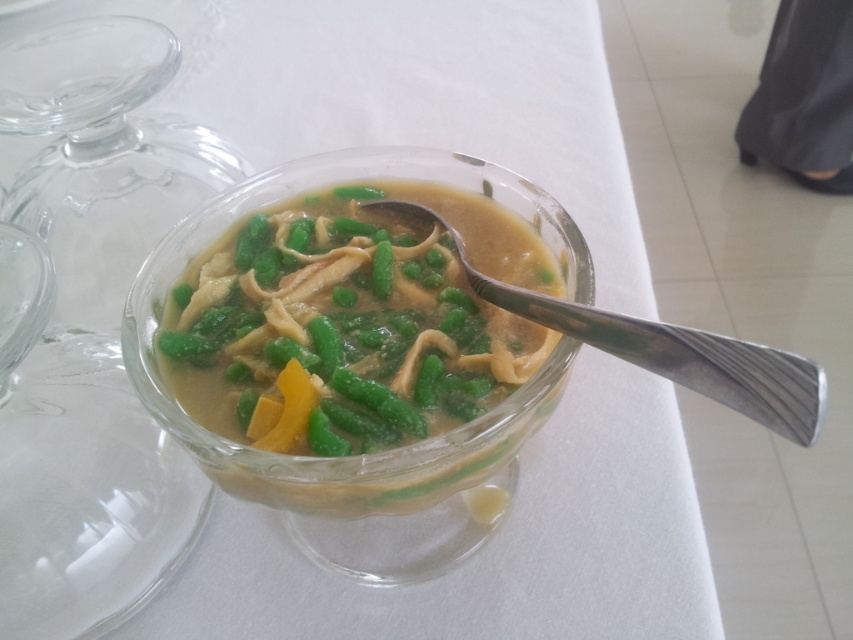
Question: Can you confirm if translucent glass bowl at center is bigger than silver metallic spoon at center?

Choices:
 (A) no
 (B) yes

Answer: (B)

Question: Which of the following is the closest to the observer?

Choices:
 (A) (628, 360)
 (B) (280, 257)

Answer: (A)

Question: Is translucent glass bowl at center to the left of silver metallic spoon at center from the viewer's perspective?

Choices:
 (A) no
 (B) yes

Answer: (B)

Question: Among these objects, which one is nearest to the camera?

Choices:
 (A) silver metallic spoon at center
 (B) translucent glass bowl at center

Answer: (A)

Question: Which point is farther to the camera?

Choices:
 (A) (469, 284)
 (B) (490, 256)

Answer: (B)

Question: Where is translucent glass bowl at center located in relation to silver metallic spoon at center in the image?

Choices:
 (A) left
 (B) right

Answer: (A)